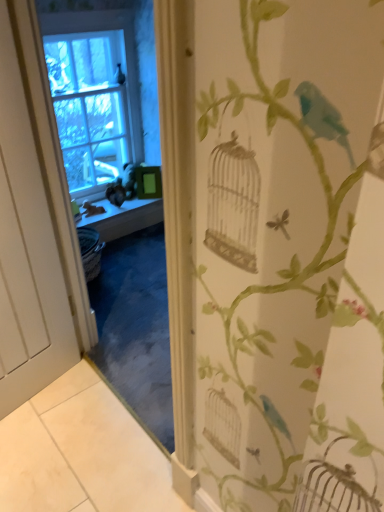
Measure the distance between smooth wooden window sill at center and camera.

smooth wooden window sill at center and camera are 2.63 meters apart from each other.

Locate an element on the screen. The height and width of the screenshot is (512, 384). smooth wooden window sill at center is located at coordinates (112, 210).

The height and width of the screenshot is (512, 384). In order to click on door in front of the clear glass window at upper left in this screenshot , I will do `click(27, 241)`.

Is white matte door at left touching clear glass window at upper left?

white matte door at left and clear glass window at upper left are clearly separated.

How different are the orientations of white matte door at left and clear glass window at upper left in degrees?

There is a 10.1-degree angle between the facing directions of white matte door at left and clear glass window at upper left.

From the image's perspective, does clear glass window at upper left appear lower than white matte door at left?

Actually, clear glass window at upper left appears above white matte door at left in the image.

How distant is clear glass window at upper left from white matte door at left?

clear glass window at upper left is 4.90 feet from white matte door at left.

Consider the image. From a real-world perspective, is clear glass window at upper left above or below white matte door at left?

clear glass window at upper left is situated higher than white matte door at left in the real world.

Looking at this image, which object is positioned more to the left, clear glass window at upper left or white matte door at left?

clear glass window at upper left.

Can you confirm if white matte door at left is positioned to the right of smooth wooden window sill at center?

No.

Is point (1, 65) in front of point (115, 210)?

Yes.

In the scene shown: From a real-world perspective, which is physically above, white matte door at left or smooth wooden window sill at center?

white matte door at left.

Is white matte door at left at the back of smooth wooden window sill at center?

No, smooth wooden window sill at center is not facing the opposite direction of white matte door at left.

Who is shorter, smooth wooden window sill at center or white matte door at left?

Standing shorter between the two is smooth wooden window sill at center.

From the image's perspective, which one is positioned higher, smooth wooden window sill at center or white matte door at left?

smooth wooden window sill at center is shown above in the image.

Which of these two, smooth wooden window sill at center or clear glass window at upper left, is thinner?

Thinner between the two is clear glass window at upper left.

Considering the relative positions of smooth wooden window sill at center and clear glass window at upper left in the image provided, is smooth wooden window sill at center to the left or to the right of clear glass window at upper left?

Clearly, smooth wooden window sill at center is on the right of clear glass window at upper left in the image.

Can you confirm if smooth wooden window sill at center is taller than clear glass window at upper left?

No, smooth wooden window sill at center is not taller than clear glass window at upper left.

Based on the photo, visually, is clear glass window at upper left positioned to the left or to the right of smooth wooden window sill at center?

In the image, clear glass window at upper left appears on the left side of smooth wooden window sill at center.

Is clear glass window at upper left located outside smooth wooden window sill at center?

Yes.

Would you say clear glass window at upper left is a long distance from smooth wooden window sill at center?

That's not correct — clear glass window at upper left is a little close to smooth wooden window sill at center.

Locate an element on the screen. window that is above the white matte door at left (from a real-world perspective) is located at coordinates (94, 95).

Where is `window above the white matte door at left (from the image's perspective)`? This screenshot has height=512, width=384. window above the white matte door at left (from the image's perspective) is located at coordinates (94, 95).

Looking at the image, which one is located closer to smooth wooden window sill at center, white matte door at left or clear glass window at upper left?

Based on the image, clear glass window at upper left appears to be nearer to smooth wooden window sill at center.

Which object lies nearer to the anchor point white matte door at left, smooth wooden window sill at center or clear glass window at upper left?

The object closer to white matte door at left is smooth wooden window sill at center.

Looking at the image, which one is located closer to smooth wooden window sill at center, clear glass window at upper left or white matte door at left?

clear glass window at upper left is positioned closer to the anchor smooth wooden window sill at center.

Which object lies further to the anchor point clear glass window at upper left, smooth wooden window sill at center or white matte door at left?

white matte door at left.

Looking at the image, which one is located further to clear glass window at upper left, white matte door at left or smooth wooden window sill at center?

Based on the image, white matte door at left appears to be further to clear glass window at upper left.

Looking at the image, which one is located closer to white matte door at left, clear glass window at upper left or smooth wooden window sill at center?

Among the two, smooth wooden window sill at center is located nearer to white matte door at left.

At what (x,y) coordinates should I click in order to perform the action: click on window between white matte door at left and smooth wooden window sill at center in the front-back direction. Please return your answer as a coordinate pair (x, y). Looking at the image, I should click on (94, 95).